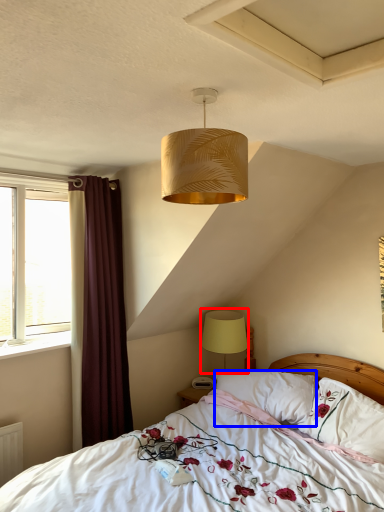
Question: Which of the following is the closest to the observer, lamp (highlighted by a red box) or pillow (highlighted by a blue box)?

Choices:
 (A) lamp
 (B) pillow

Answer: (B)